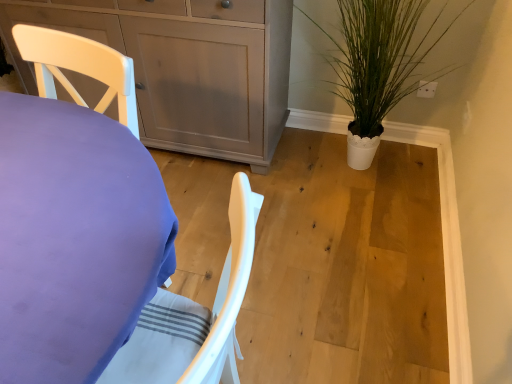
What is the approximate width of purple fabric-covered desk at left?

purple fabric-covered desk at left is 51.88 centimeters in width.

At what (x,y) coordinates should I click in order to perform the action: click on matte gray cabinet at upper left. Please return your answer as a coordinate pair (x, y). Looking at the image, I should click on (187, 67).

Considering the positions of objects purple fabric-covered desk at left and matte gray cabinet at upper left in the image provided, who is more to the right, purple fabric-covered desk at left or matte gray cabinet at upper left?

From the viewer's perspective, matte gray cabinet at upper left appears more on the right side.

From a real-world perspective, is purple fabric-covered desk at left over matte gray cabinet at upper left?

Yes, from a real-world perspective, purple fabric-covered desk at left is over matte gray cabinet at upper left

Is the depth of purple fabric-covered desk at left greater than that of matte gray cabinet at upper left?

No, purple fabric-covered desk at left is closer to the camera.

Is matte gray cabinet at upper left next to white matte pot at right and touching it?

No, matte gray cabinet at upper left is not with white matte pot at right.

From a real-world perspective, is matte gray cabinet at upper left above or below white matte pot at right?

Clearly, from a real-world perspective, matte gray cabinet at upper left is below white matte pot at right.

This screenshot has height=384, width=512. What are the coordinates of `cabinetry lying above the white matte pot at right (from the image's perspective)` in the screenshot? It's located at [x=187, y=67].

Is point (219, 151) farther from viewer compared to point (445, 31)?

Yes, it is.

Is purple fabric-covered desk at left turned away from white matte pot at right?

No.

Which object is thinner, purple fabric-covered desk at left or white matte pot at right?

purple fabric-covered desk at left.

At what (x,y) coordinates should I click in order to perform the action: click on desk that appears on the left of white matte pot at right. Please return your answer as a coordinate pair (x, y). The image size is (512, 384). Looking at the image, I should click on (75, 239).

From a real-world perspective, which object stands above the other?

purple fabric-covered desk at left.

How much distance is there between white matte pot at right and matte gray cabinet at upper left?

white matte pot at right is 21.18 inches from matte gray cabinet at upper left.

Which object is positioned more to the right, white matte pot at right or matte gray cabinet at upper left?

white matte pot at right.

Considering the positions of objects white matte pot at right and matte gray cabinet at upper left in the image provided, who is behind, white matte pot at right or matte gray cabinet at upper left?

matte gray cabinet at upper left is further from the camera.

Is white matte pot at right directly adjacent to matte gray cabinet at upper left?

No, white matte pot at right is not touching matte gray cabinet at upper left.

Does point (142, 98) appear closer or farther from the camera than point (147, 185)?

Point (142, 98) appears to be farther away from the viewer than point (147, 185).

Which of these two, matte gray cabinet at upper left or purple fabric-covered desk at left, is smaller?

purple fabric-covered desk at left.

How different are the orientations of matte gray cabinet at upper left and purple fabric-covered desk at left in degrees?

12.7 degrees.

Which is correct: white matte pot at right is inside purple fabric-covered desk at left, or outside of it?

The correct answer is: outside.

From the image's perspective, which is below, white matte pot at right or purple fabric-covered desk at left?

purple fabric-covered desk at left.

From the picture: From a real-world perspective, which is physically above, white matte pot at right or purple fabric-covered desk at left?

purple fabric-covered desk at left.

Is white matte pot at right far from purple fabric-covered desk at left?

That's right, there is a large distance between white matte pot at right and purple fabric-covered desk at left.

Where is `desk positioned vertically above the matte gray cabinet at upper left (from a real-world perspective)`? This screenshot has height=384, width=512. desk positioned vertically above the matte gray cabinet at upper left (from a real-world perspective) is located at coordinates (75, 239).

The width and height of the screenshot is (512, 384). What are the coordinates of `houseplant in front of the matte gray cabinet at upper left` in the screenshot? It's located at (378, 64).

From the image, which object appears to be nearer to matte gray cabinet at upper left, white matte pot at right or purple fabric-covered desk at left?

white matte pot at right is positioned closer to the anchor matte gray cabinet at upper left.

Looking at the image, which one is located closer to white matte pot at right, purple fabric-covered desk at left or matte gray cabinet at upper left?

The object closer to white matte pot at right is matte gray cabinet at upper left.

From the image, which object appears to be nearer to purple fabric-covered desk at left, white matte pot at right or matte gray cabinet at upper left?

matte gray cabinet at upper left lies closer to purple fabric-covered desk at left than the other object.

Looking at this image, considering their positions, is matte gray cabinet at upper left positioned further to purple fabric-covered desk at left than white matte pot at right?

white matte pot at right is positioned further to the anchor purple fabric-covered desk at left.

From the image, which object appears to be nearer to white matte pot at right, matte gray cabinet at upper left or purple fabric-covered desk at left?

matte gray cabinet at upper left is positioned closer to the anchor white matte pot at right.

Estimate the real-world distances between objects in this image. Which object is closer to matte gray cabinet at upper left, purple fabric-covered desk at left or white matte pot at right?

Based on the image, white matte pot at right appears to be nearer to matte gray cabinet at upper left.

Locate an element on the screen. cabinetry between purple fabric-covered desk at left and white matte pot at right is located at coordinates (187, 67).